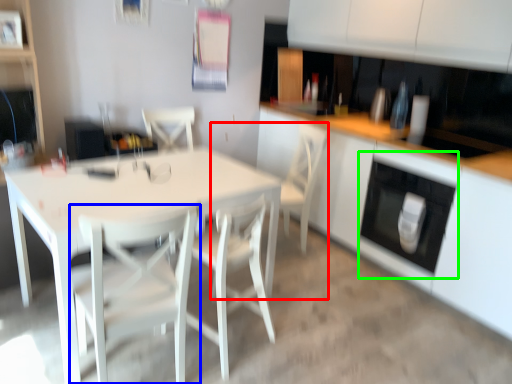
Question: Considering the real-world distances, which object is closest to armchair (highlighted by a red box)? chair (highlighted by a blue box) or oven (highlighted by a green box).

Choices:
 (A) chair
 (B) oven

Answer: (B)